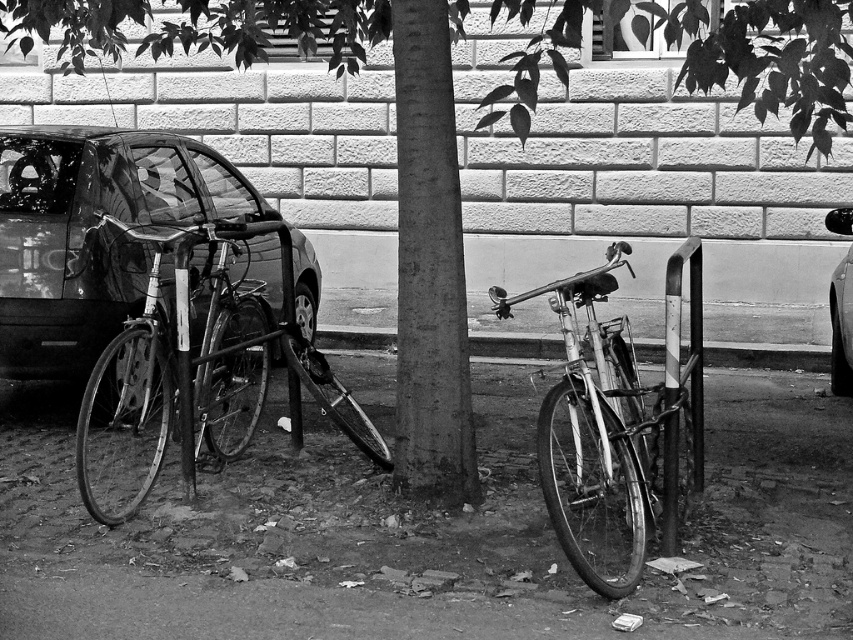
Does shiny silver bicycle at center appear over metallic silver car at right?

No, shiny silver bicycle at center is not above metallic silver car at right.

Who is shorter, shiny silver bicycle at center or metallic silver car at right?

metallic silver car at right is shorter.

Who is more distant from viewer, [701,406] or [824,224]?

The point [824,224] is more distant.

You are a GUI agent. You are given a task and a screenshot of the screen. Output one action in this format:
    pyautogui.click(x=<x>, y=<y>)
    Task: Click on the shiny silver bicycle at center
    This screenshot has width=853, height=640.
    Given the screenshot: What is the action you would take?
    pyautogui.click(x=618, y=416)

This screenshot has height=640, width=853. What do you see at coordinates (94, 232) in the screenshot? I see `glossy metallic car at left` at bounding box center [94, 232].

Can you confirm if glossy metallic car at left is positioned to the left of metallic silver car at right?

Correct, you'll find glossy metallic car at left to the left of metallic silver car at right.

At what (x,y) coordinates should I click in order to perform the action: click on glossy metallic car at left. Please return your answer as a coordinate pair (x, y). This screenshot has width=853, height=640. Looking at the image, I should click on (94, 232).

Image resolution: width=853 pixels, height=640 pixels. Find the location of `glossy metallic car at left`. glossy metallic car at left is located at coordinates (94, 232).

Can you confirm if glossy metallic car at left is positioned above shiny silver bicycle at center?

Indeed, glossy metallic car at left is positioned over shiny silver bicycle at center.

Between glossy metallic car at left and shiny silver bicycle at center, which one has more height?

glossy metallic car at left

At what (x,y) coordinates should I click in order to perform the action: click on glossy metallic car at left. Please return your answer as a coordinate pair (x, y). The image size is (853, 640). Looking at the image, I should click on (94, 232).

Where is `glossy metallic car at left`? This screenshot has width=853, height=640. glossy metallic car at left is located at coordinates (94, 232).